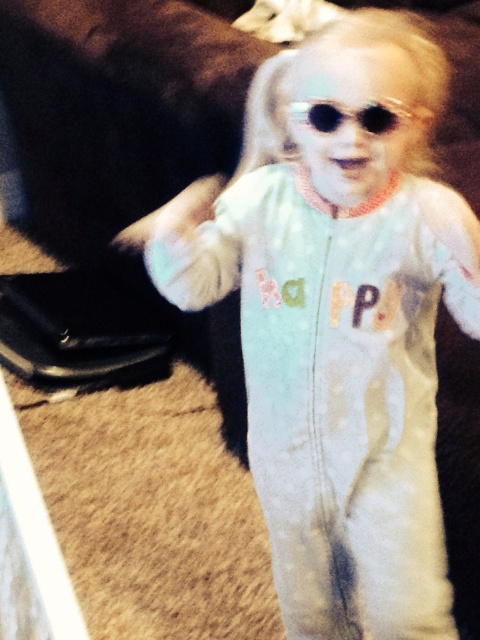
The child is wearing a white soft onesie at center and sunglasses at center. Which clothing item is positioned lower on the child?

The white soft onesie at center is located below the sunglasses at center, so the onesie is positioned lower on the child.

You are a photographer adjusting your camera settings to focus on the white soft onesie at center and the sunglasses at center. Which object should you focus on first to ensure proper depth of field?

You should focus on the white soft onesie at center first because it is closer to the viewer than the sunglasses at center, ensuring the depth of field captures both objects clearly.

You are a photographer trying to capture a closeup shot of the child in the image. The camera you are using has a focal length of 50mm and a sensor size of 24mm x 36mm. If the point at coordinates point (181, 296) is 1.07 meters from the camera, can you determine if this point is within the camera sensor coverage area?

The point at coordinates point (181, 296) is 1.07 meters from the camera. Since the camera sensor size is 24mm x 36mm, the coverage area at that distance would be calculated using the formula for field of view. However, without knowing the exact angle of view or the distance from the sensor to the lens, it is not possible to definitively determine if the point is within the sensor coverage area based on the provided information.